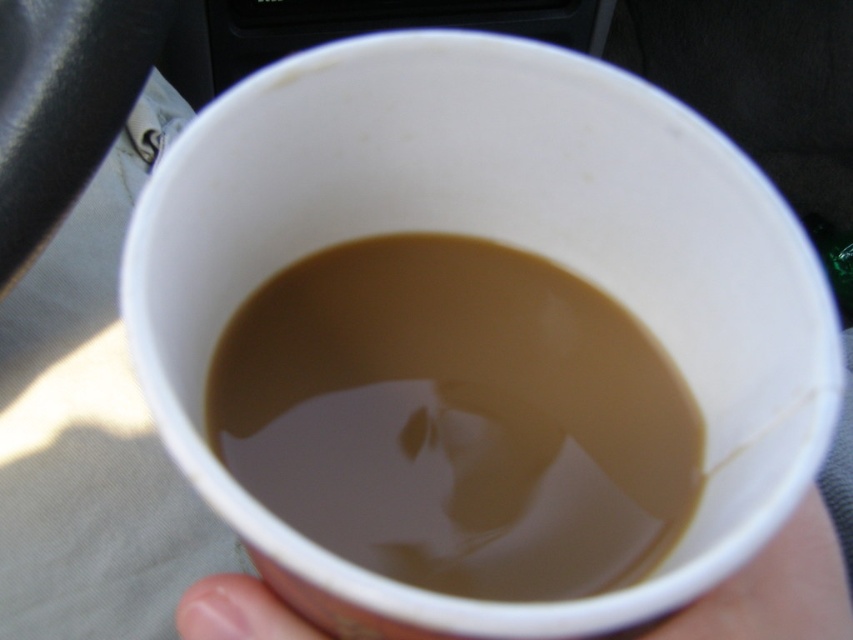
Can you confirm if brown matte coffee at center is positioned above white paper cup at lower center?

Yes, brown matte coffee at center is above white paper cup at lower center.

Which is behind, point (583, 410) or point (296, 611)?

Point (583, 410)

Image resolution: width=853 pixels, height=640 pixels. I want to click on brown matte coffee at center, so click(457, 419).